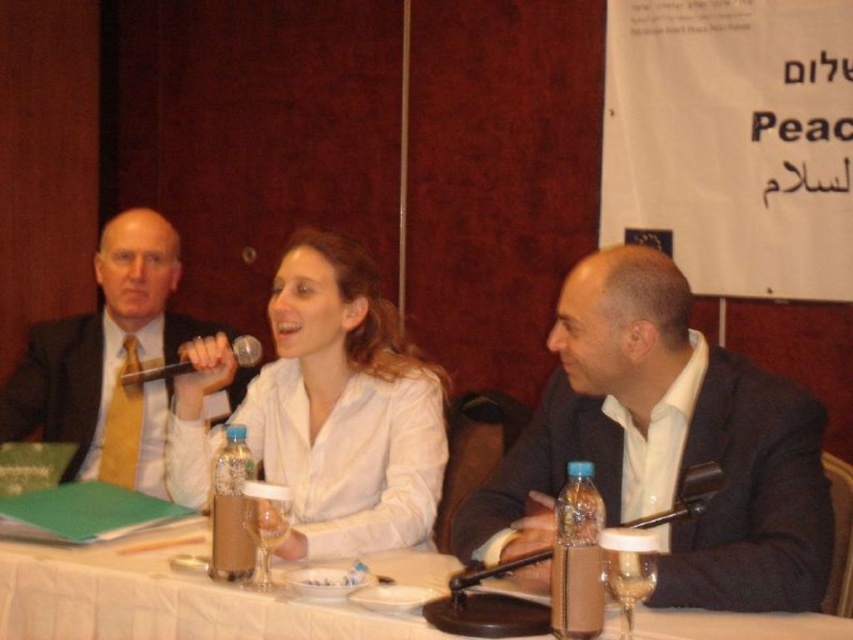
You are organizing a conference and need to choose between the black plastic microphone at lower right and the metallic silver microphone at upper center for a speaker who prefers a thicker grip. Which microphone should you select?

The metallic silver microphone at upper center is thicker than the black plastic microphone at lower right, so it should be chosen for the speaker who prefers a thicker grip.

You are a photographer setting up for a panel discussion. You need to place a microphone stand exactly at the midpoint between the white matte shirt at center and the dark suit with a light blue shirt and gold tie on the left. What are the coordinates of this midpoint?

The midpoint between the white matte shirt at center and the dark suit with a light blue shirt and gold tie on the left would be at the average of their coordinates. However, the coordinates for the dark suit with a light blue shirt and gold tie on the left are not provided. Without this information, the exact midpoint cannot be calculated.